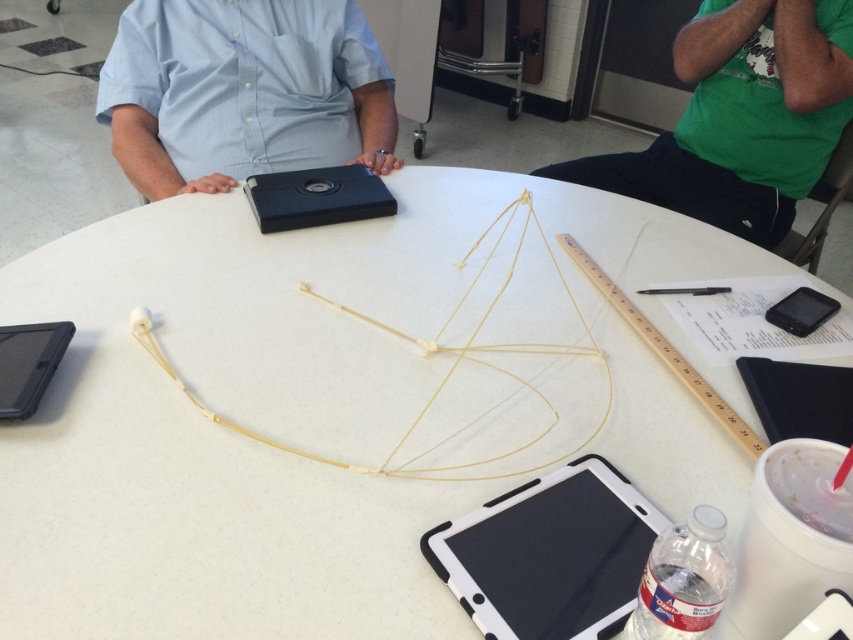
You are a tailor observing the two shirts on the table. The matte blue shirt at center and the green cotton shirt at upper right. Which shirt has a shorter length?

The matte blue shirt at center is shorter than the green cotton shirt at upper right.

You are organizing a craft activity and need to know which item on the table is bigger between the white rubber string at center and the black matte tablet at lower left. Could you identify the larger one?

The white rubber string at center is larger in size than the black matte tablet at lower left.